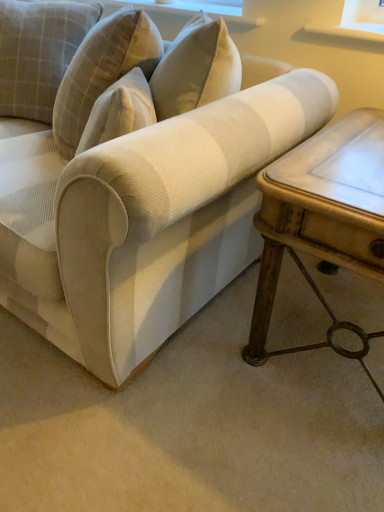
Question: From the image's perspective, relative to plaid fabric pillow at upper left, is white textured fabric couch at center above or below?

Choices:
 (A) above
 (B) below

Answer: (B)

Question: Relative to plaid fabric pillow at upper left, is white textured fabric couch at center in front or behind?

Choices:
 (A) front
 (B) behind

Answer: (A)

Question: Based on their relative distances, which object is nearer to the white marble table at right?

Choices:
 (A) white textured fabric couch at center
 (B) plaid fabric pillow at upper left

Answer: (A)

Question: Which object is positioned farthest from the white textured fabric couch at center?

Choices:
 (A) plaid fabric pillow at upper left
 (B) white marble table at right

Answer: (A)